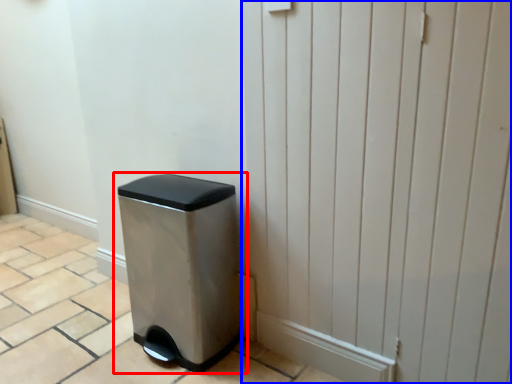
Question: Which of the following is the closest to the observer, waste container (highlighted by a red box) or screen door (highlighted by a blue box)?

Choices:
 (A) waste container
 (B) screen door

Answer: (B)